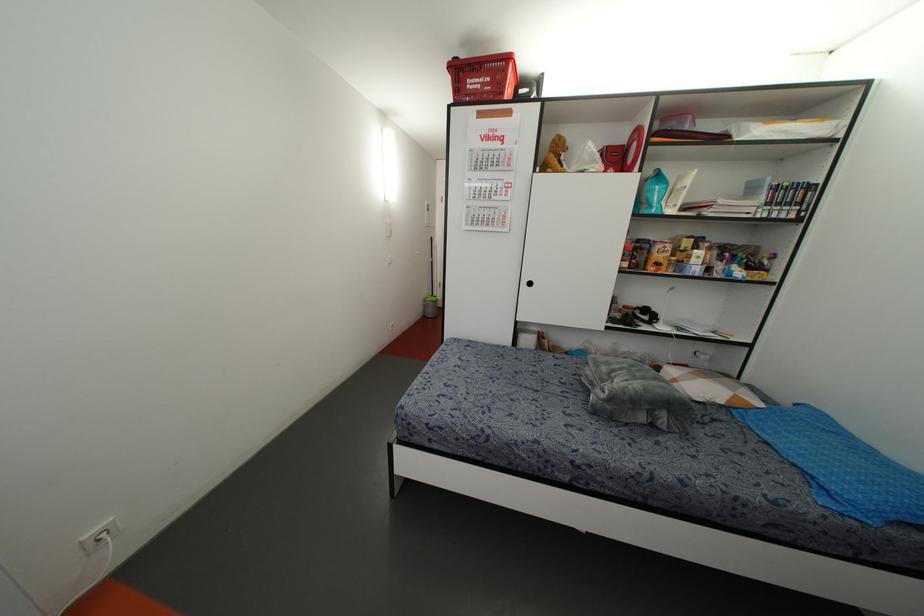
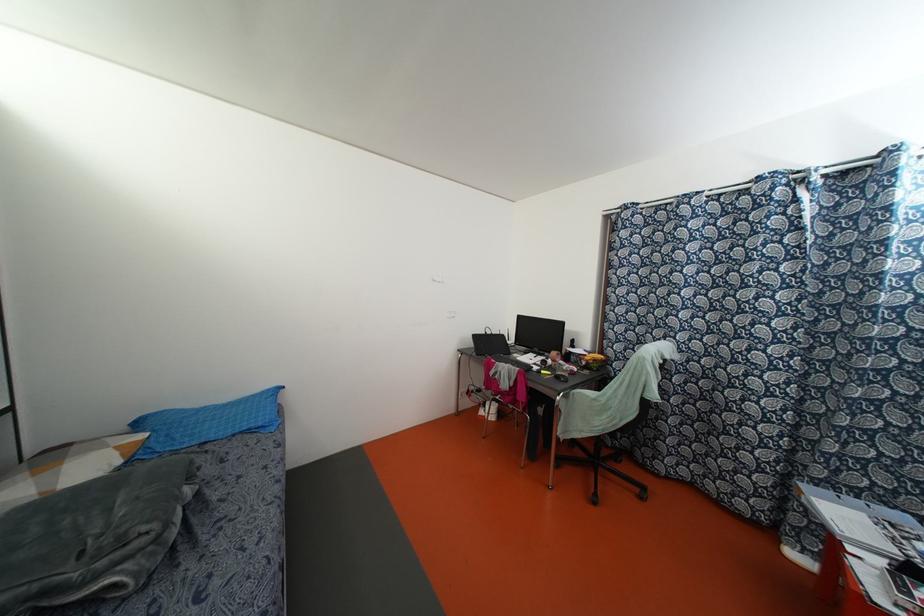
Find the pixel in the second image that matches point (720, 400) in the first image.

(118, 461)